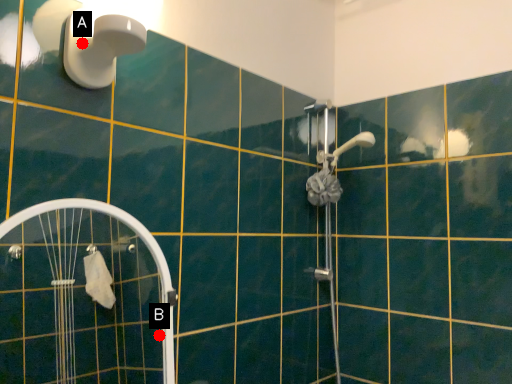
Question: Two points are circled on the image, labeled by A and B beside each circle. Among these points, which one is farthest from the camera?

Choices:
 (A) A is further
 (B) B is further

Answer: (B)